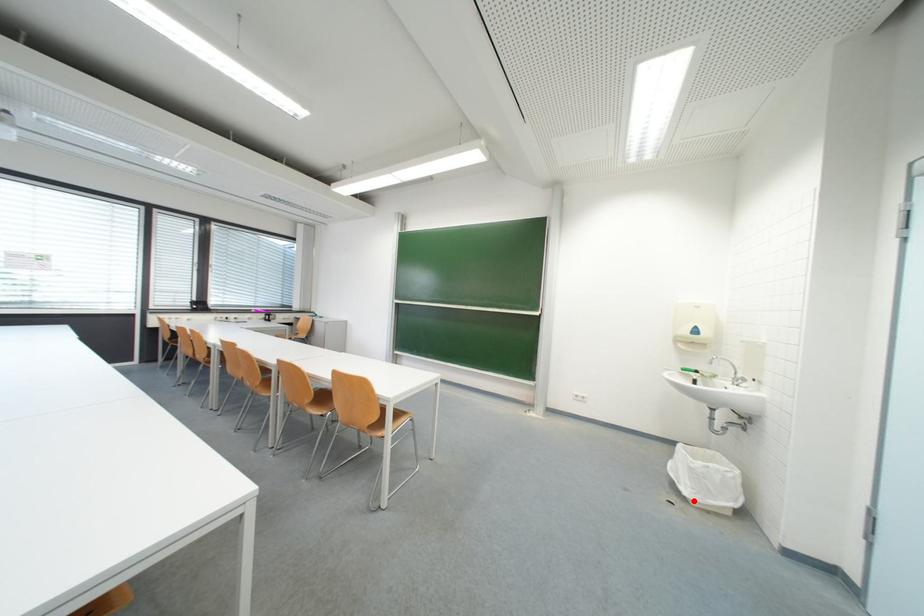
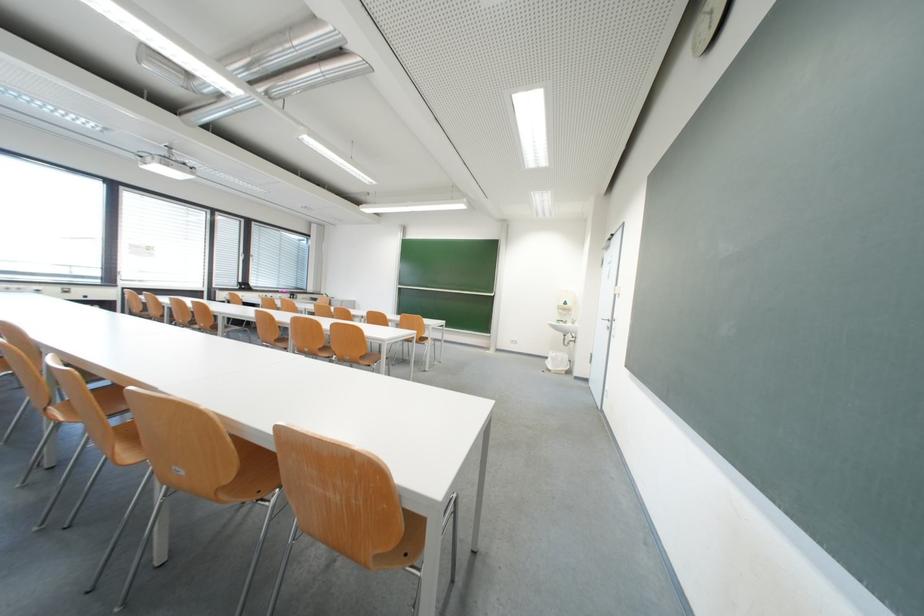
Question: A red point is marked in image1. In image2, is the corresponding 3D point closer to the camera or farther? Reply with the corresponding letter.

Choices:
 (A) The corresponding 3D point is closer.
 (B) The corresponding 3D point is farther.

Answer: (B)